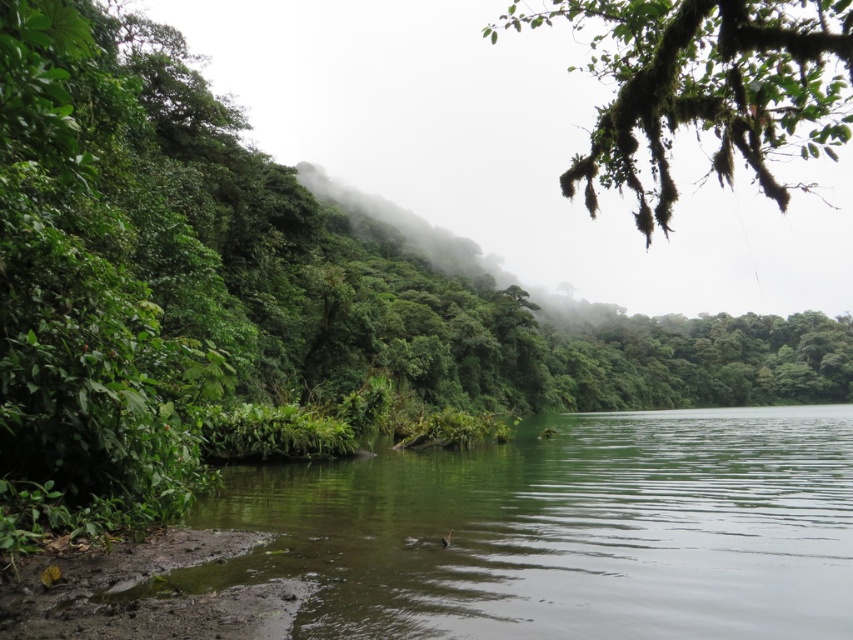
Does green smooth water at lower center have a greater width compared to green mossy branch at upper right?

No.

Can you confirm if green smooth water at lower center is smaller than green mossy branch at upper right?

Yes.

Is point (775, 561) less distant than point (840, 140)?

No.

This screenshot has height=640, width=853. I want to click on green smooth water at lower center, so click(567, 531).

At what (x,y) coordinates should I click in order to perform the action: click on green mossy branch at upper right. Please return your answer as a coordinate pair (x, y). This screenshot has width=853, height=640. Looking at the image, I should click on (705, 88).

This screenshot has width=853, height=640. Find the location of `green mossy branch at upper right`. green mossy branch at upper right is located at coordinates (705, 88).

Based on the photo, can you confirm if green smooth water at lower center is positioned above green leafy fog at center?

Incorrect, green smooth water at lower center is not positioned above green leafy fog at center.

Is point (646, 563) less distant than point (602, 332)?

That is True.

Image resolution: width=853 pixels, height=640 pixels. I want to click on green smooth water at lower center, so point(567,531).